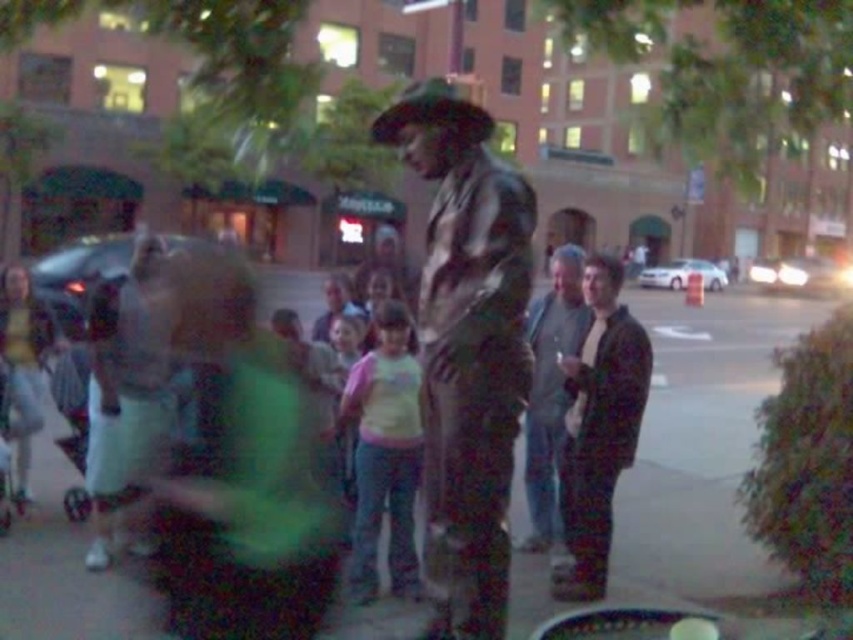
Question: Among these objects, which one is farthest from the camera?

Choices:
 (A) green fabric at center
 (B) shiny brown leather jacket at center

Answer: (A)

Question: Which object appears closest to the camera in this image?

Choices:
 (A) green fabric at center
 (B) shiny brown leather jacket at center
 (C) gray fabric jacket at center

Answer: (B)

Question: Is green fabric at center smaller than shiny brown leather jacket at center?

Choices:
 (A) no
 (B) yes

Answer: (A)

Question: Which point is closer to the camera?

Choices:
 (A) (432, 170)
 (B) (643, 419)
 (C) (569, 262)

Answer: (A)

Question: Does green fabric at center have a smaller size compared to shiny brown leather jacket at center?

Choices:
 (A) yes
 (B) no

Answer: (B)

Question: Can you confirm if shiny brown leather jacket at center is positioned above gray fabric jacket at center?

Choices:
 (A) no
 (B) yes

Answer: (B)